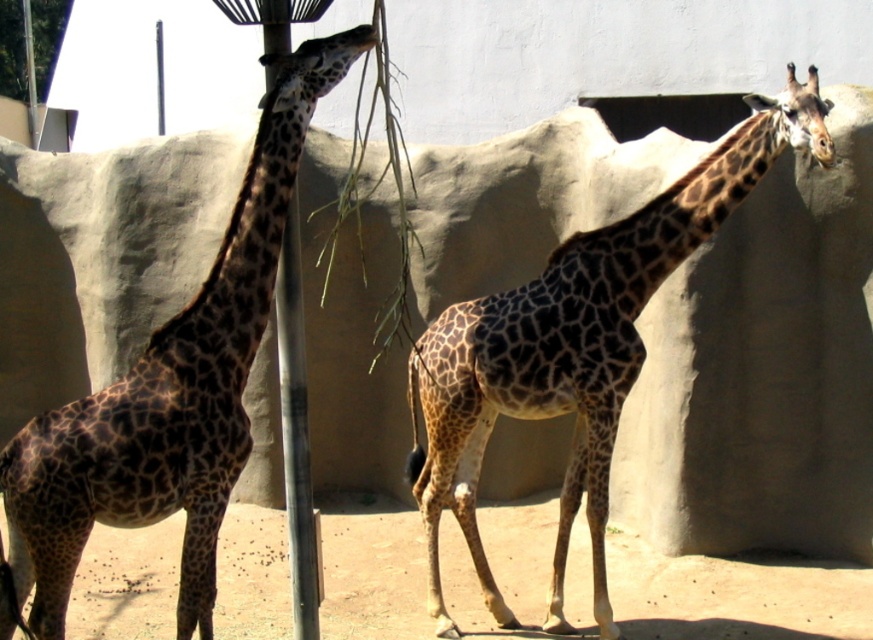
Does spotted fur giraffe at left have a greater width compared to spotted fur giraffe at center?

No, spotted fur giraffe at left is not wider than spotted fur giraffe at center.

Is spotted fur giraffe at left bigger than spotted fur giraffe at center?

No.

Is point (155, 404) positioned behind point (652, 230)?

No, it is not.

This screenshot has width=873, height=640. I want to click on spotted fur giraffe at left, so click(168, 392).